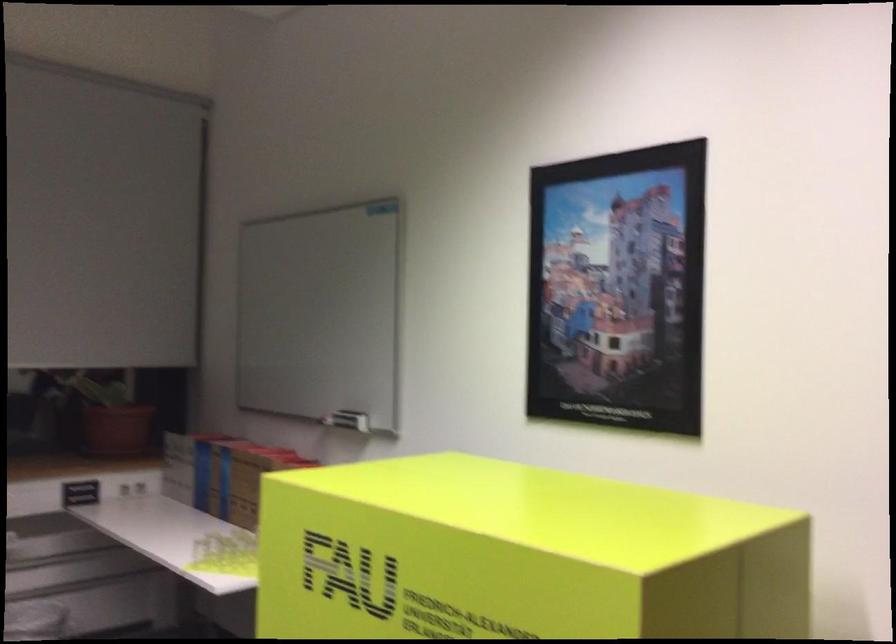
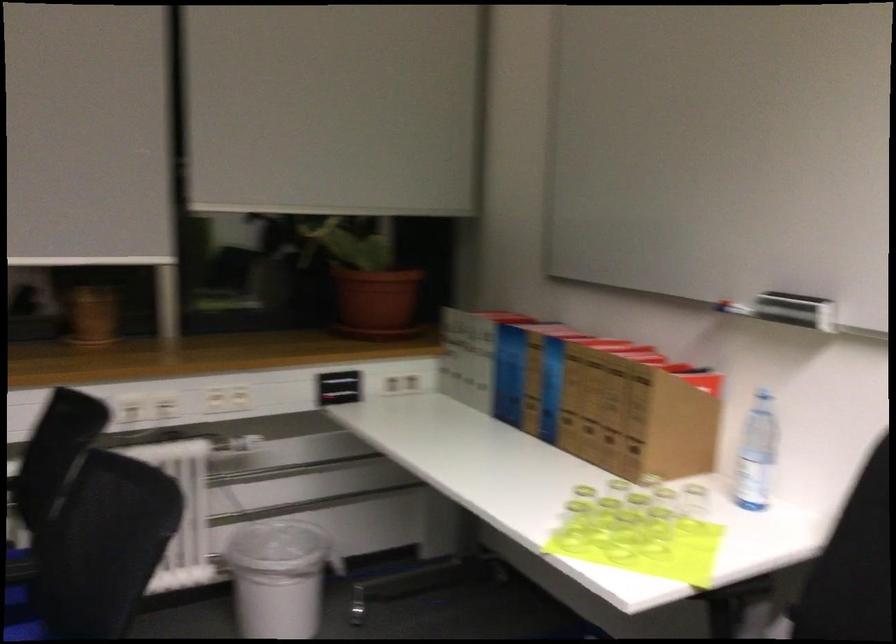
In the second image, find the point that corresponds to (x=210, y=558) in the first image.

(573, 526)